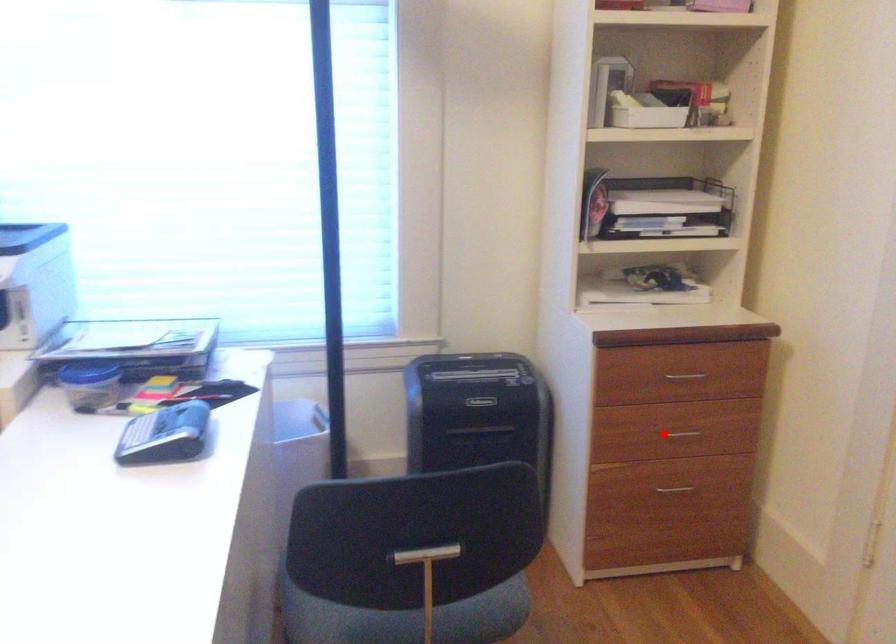
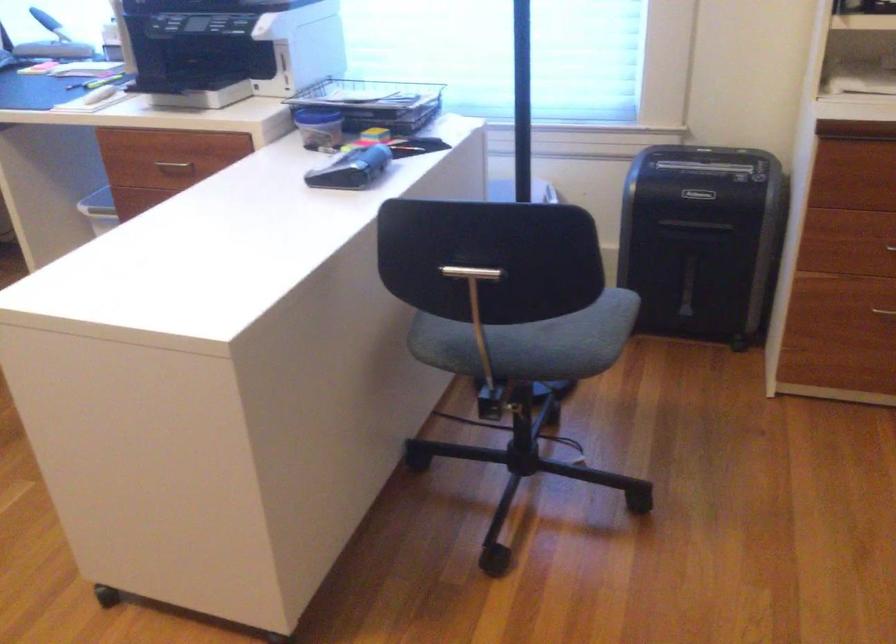
In the second image, find the point that corresponds to the highlighted location in the first image.

(890, 247)